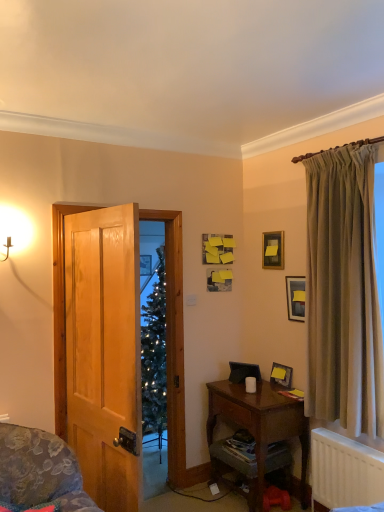
Question: Are matte black picture frame at upper center, placed as the second picture frame when sorted from top to bottom, and wooden desk at lower right making contact?

Choices:
 (A) yes
 (B) no

Answer: (B)

Question: Is matte black picture frame at upper center, which is the 2th picture frame from bottom to top, to the left of wooden desk at lower right from the viewer's perspective?

Choices:
 (A) yes
 (B) no

Answer: (B)

Question: Considering the relative positions of matte black picture frame at upper center, which is the 2th picture frame from bottom to top, and wooden desk at lower right in the image provided, is matte black picture frame at upper center, which is the 2th picture frame from bottom to top, behind wooden desk at lower right?

Choices:
 (A) yes
 (B) no

Answer: (A)

Question: Is matte black picture frame at upper center, placed as the second picture frame when sorted from top to bottom, closer to the viewer compared to wooden desk at lower right?

Choices:
 (A) no
 (B) yes

Answer: (A)

Question: Considering the relative sizes of matte black picture frame at upper center, which is the 2th picture frame from bottom to top, and wooden desk at lower right in the image provided, is matte black picture frame at upper center, which is the 2th picture frame from bottom to top, bigger than wooden desk at lower right?

Choices:
 (A) yes
 (B) no

Answer: (B)

Question: From a real-world perspective, is matte black picture frame at upper center, which is the 2th picture frame from bottom to top, on wooden desk at lower right?

Choices:
 (A) no
 (B) yes

Answer: (B)

Question: Is matte black picture frame at lower right, which appears as the 3th picture frame when viewed from the top, completely or partially outside of wooden cabinet at lower right?

Choices:
 (A) yes
 (B) no

Answer: (A)

Question: Does matte black picture frame at lower right, which appears as the 3th picture frame when viewed from the top, have a lesser height compared to wooden cabinet at lower right?

Choices:
 (A) yes
 (B) no

Answer: (A)

Question: Considering the relative sizes of matte black picture frame at lower right, which appears as the 3th picture frame when viewed from the top, and wooden cabinet at lower right in the image provided, is matte black picture frame at lower right, which appears as the 3th picture frame when viewed from the top, wider than wooden cabinet at lower right?

Choices:
 (A) yes
 (B) no

Answer: (B)

Question: Does matte black picture frame at lower right, which appears as the 3th picture frame when viewed from the top, have a lesser width compared to wooden cabinet at lower right?

Choices:
 (A) no
 (B) yes

Answer: (B)

Question: Is matte black picture frame at lower right, which appears as the 1th picture frame when ordered from the bottom, taller than wooden cabinet at lower right?

Choices:
 (A) yes
 (B) no

Answer: (B)

Question: Is wooden cabinet at lower right located within matte black picture frame at lower right, which appears as the 1th picture frame when ordered from the bottom?

Choices:
 (A) no
 (B) yes

Answer: (A)

Question: Can you confirm if wooden picture frame at upper center, placed as the third picture frame when sorted from bottom to top, is positioned to the left of wooden cabinet at lower right?

Choices:
 (A) yes
 (B) no

Answer: (B)